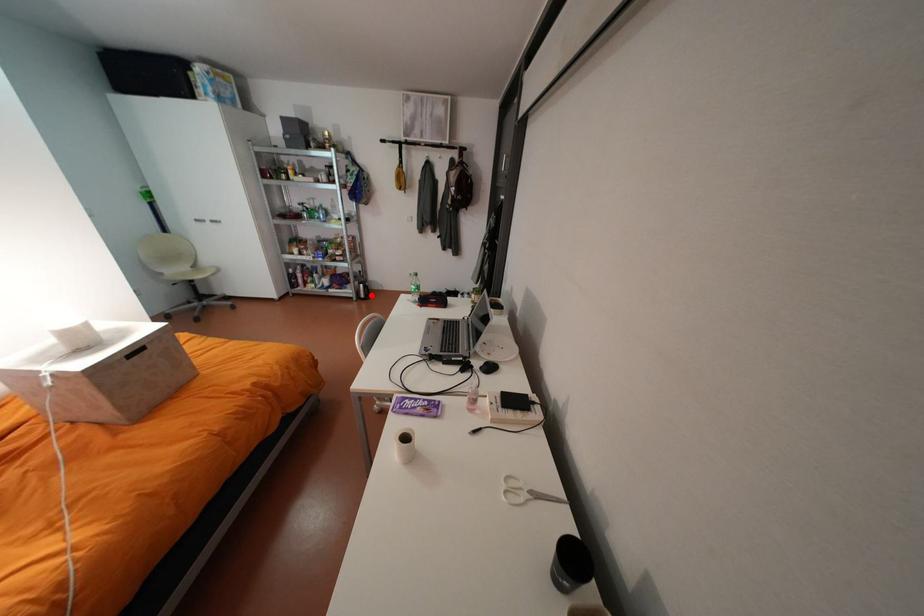
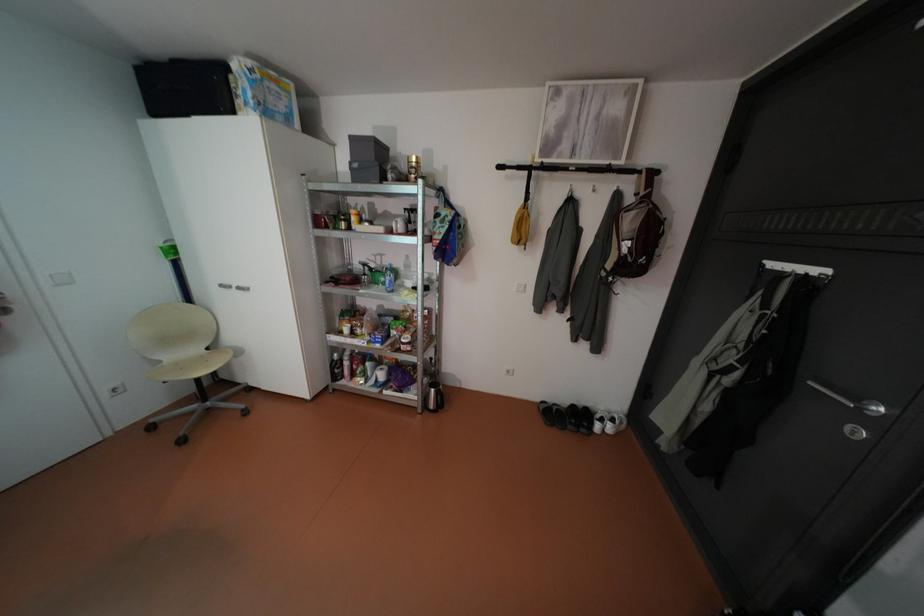
Find the pixel in the second image that matches the highlighted location in the first image.

(441, 405)